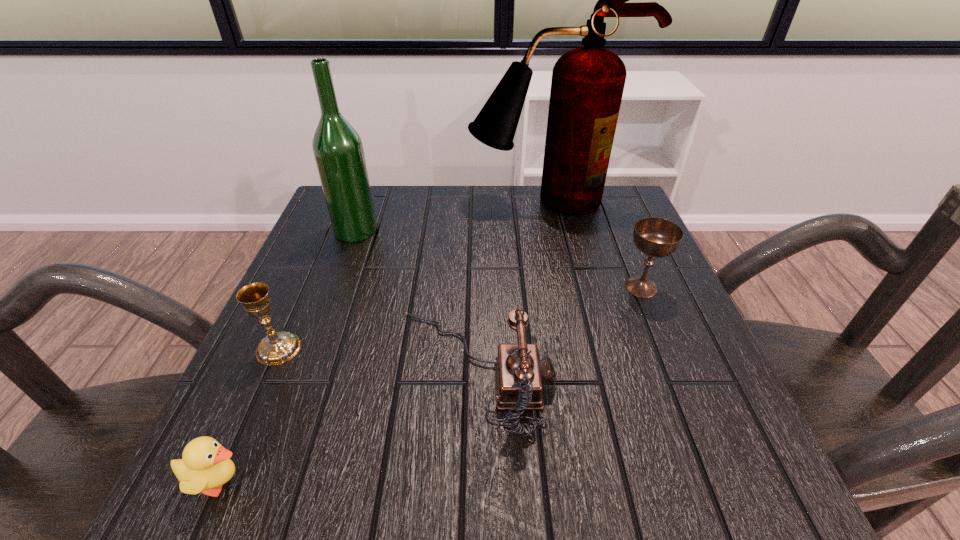
What are the coordinates of `alcohol that is at the left edge` in the screenshot? It's located at (338, 151).

The image size is (960, 540). Find the location of `chalice that is at the left edge`. chalice that is at the left edge is located at coordinates (276, 348).

Locate an element on the screen. This screenshot has height=540, width=960. duckling located at the left edge is located at coordinates (205, 466).

Locate an element on the screen. This screenshot has width=960, height=540. fire extinguisher at the right edge is located at coordinates (587, 85).

Identify the location of chalice situated at the right edge. (655, 237).

Identify the location of object located in the far left corner section of the desktop. The height and width of the screenshot is (540, 960). (338, 151).

The height and width of the screenshot is (540, 960). Identify the location of object present at the near left corner. (205, 466).

Where is `object situated at the far right corner`? The image size is (960, 540). object situated at the far right corner is located at coordinates (587, 85).

Locate an element on the screen. The width and height of the screenshot is (960, 540). vacant space at the far edge of the desktop is located at coordinates (402, 205).

Where is `free space at the near edge of the desktop`? Image resolution: width=960 pixels, height=540 pixels. free space at the near edge of the desktop is located at coordinates (587, 505).